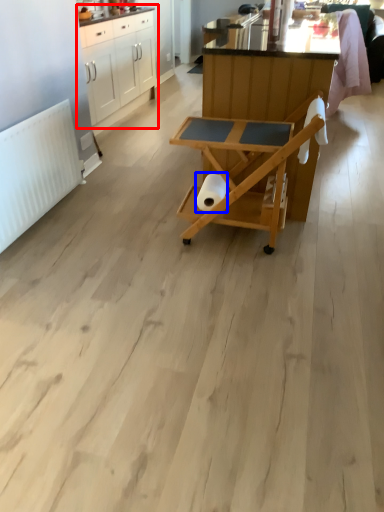
Question: Which object appears farthest to the camera in this image, cabinetry (highlighted by a red box) or toilet paper (highlighted by a blue box)?

Choices:
 (A) cabinetry
 (B) toilet paper

Answer: (A)